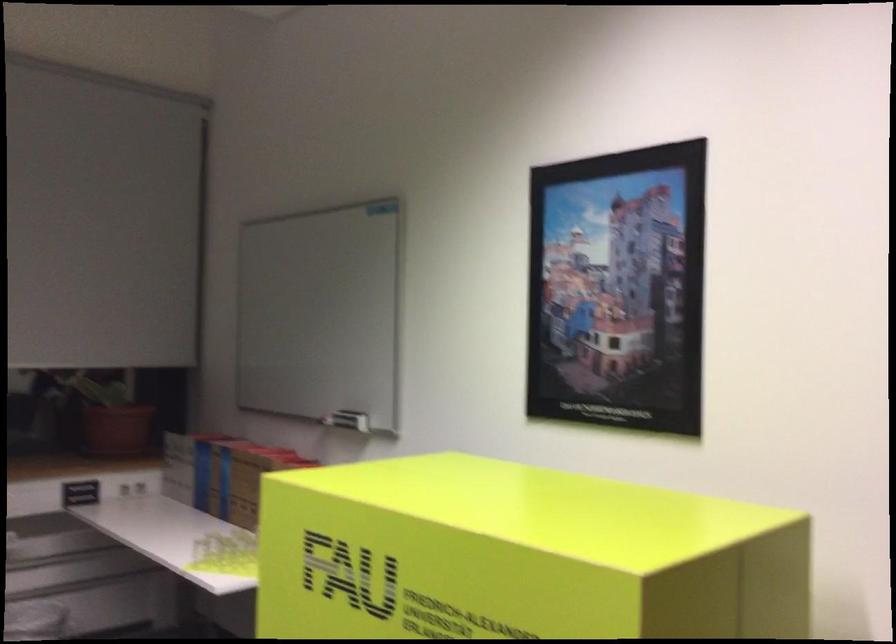
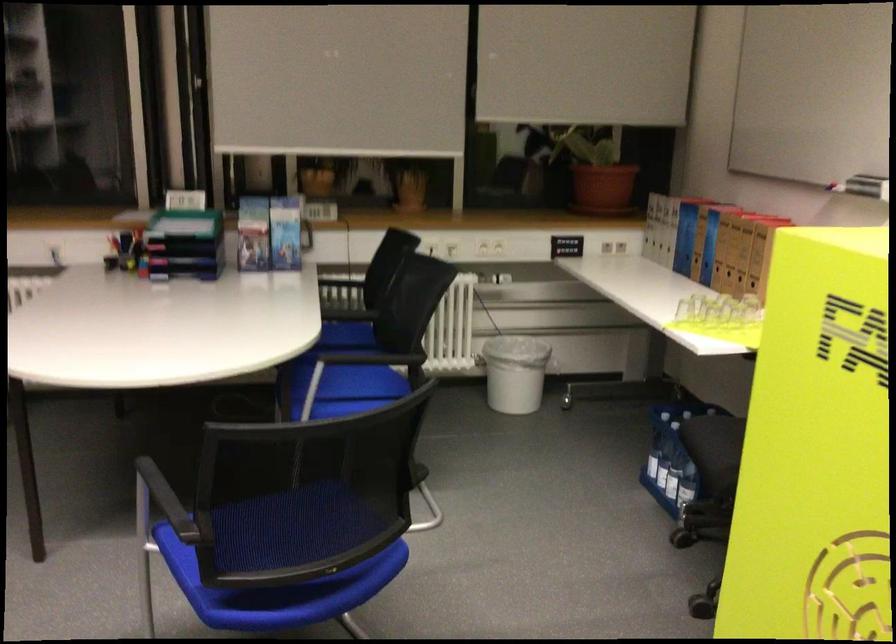
Where in the second image is the point corresponding to [203,475] from the first image?

(685, 238)